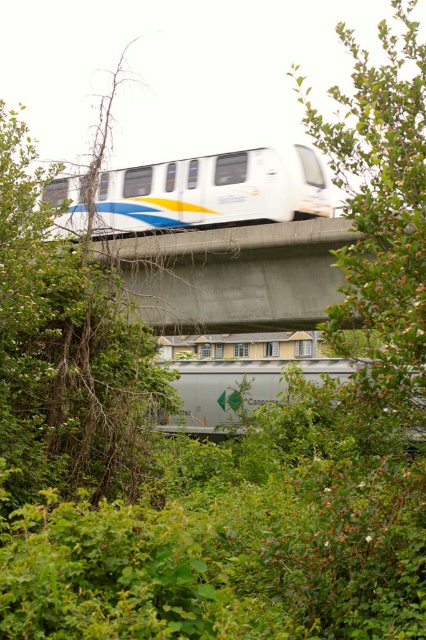
Question: Considering the real-world distances, which object is closest to the green leafy tree at left?

Choices:
 (A) concrete at center
 (B) white glossy monorail at center

Answer: (B)

Question: Can you confirm if green leafy tree at upper right is positioned above silver/grey metallic freight car at center?

Choices:
 (A) no
 (B) yes

Answer: (B)

Question: Does green leafy tree at left appear on the left side of green leafy tree at upper right?

Choices:
 (A) yes
 (B) no

Answer: (A)

Question: Among these objects, which one is farthest from the camera?

Choices:
 (A) silver/grey metallic freight car at center
 (B) concrete at center
 (C) white glossy monorail at center

Answer: (B)

Question: Estimate the real-world distances between objects in this image. Which object is farther from the concrete at center?

Choices:
 (A) green leafy tree at upper right
 (B) silver/grey metallic freight car at center

Answer: (A)

Question: Does green leafy tree at upper right have a lesser width compared to white glossy monorail at center?

Choices:
 (A) no
 (B) yes

Answer: (A)